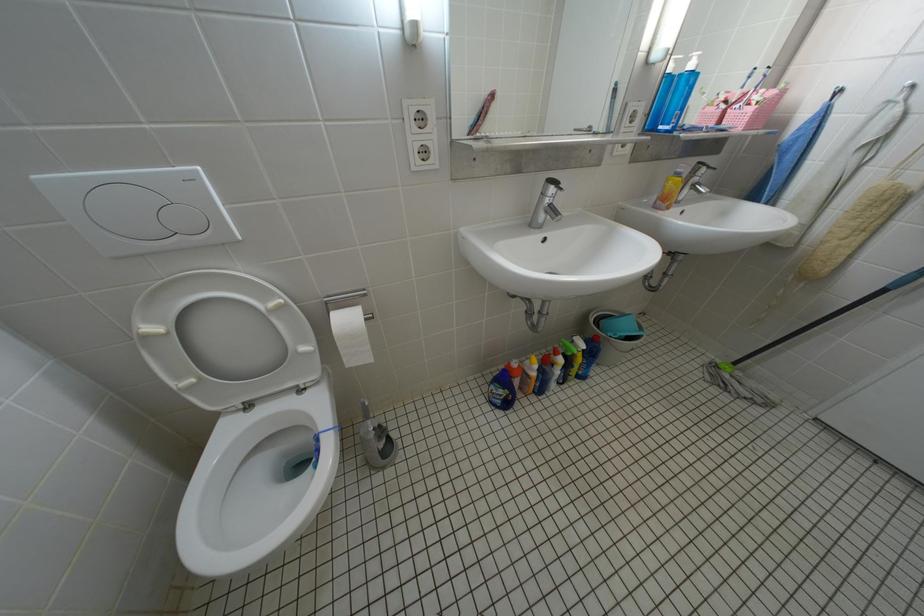
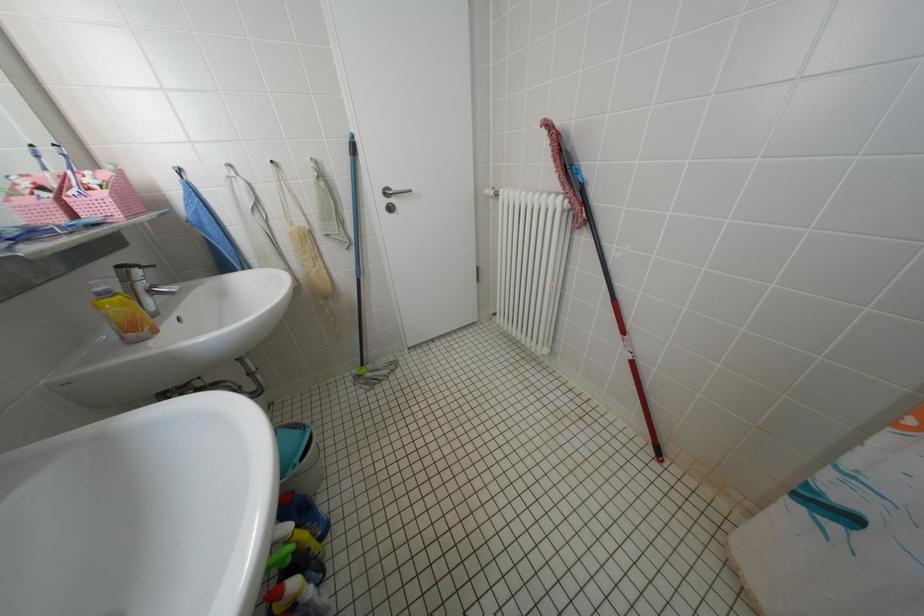
Based on the continuous images, in which direction is the camera rotating?

The camera's rotation is toward right-down.